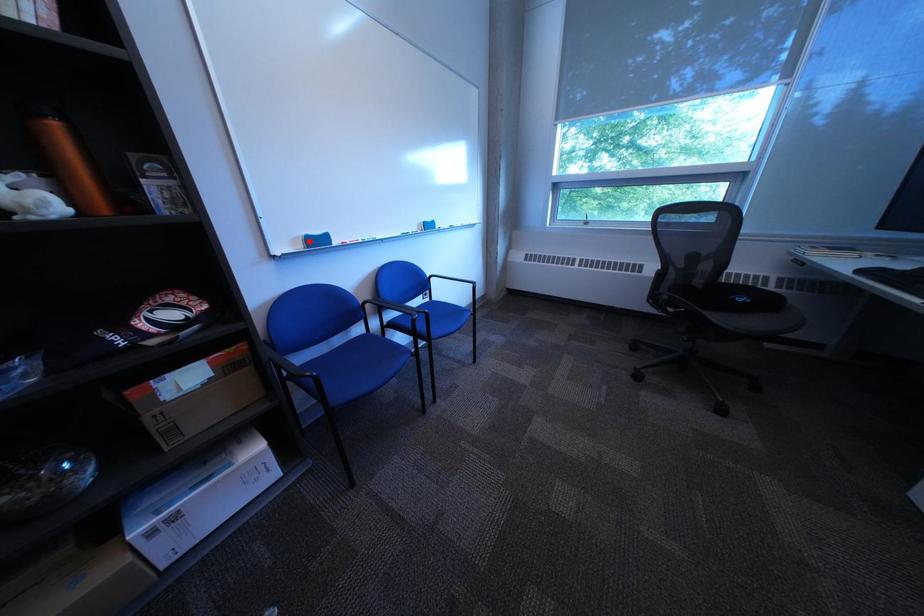
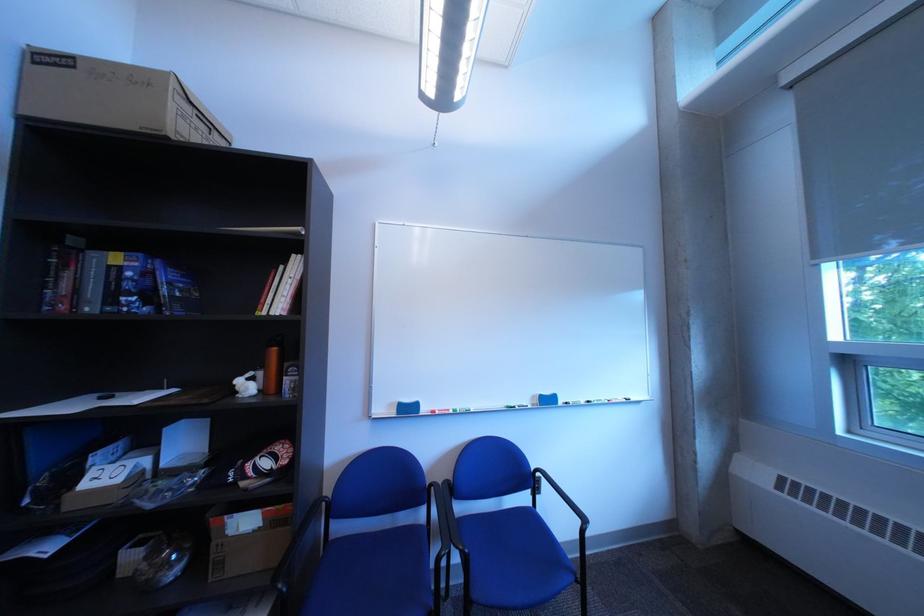
Question: I am providing you with two images of the same scene from different viewpoints. In image1, a red point is highlighted. Considering the same 3D point in image2, which of the following is correct?

Choices:
 (A) It is closer
 (B) It is farther

Answer: (B)